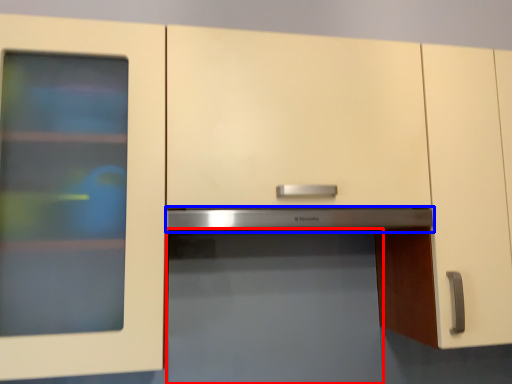
Question: Among these objects, which one is nearest to the camera, appliance (highlighted by a red box) or exhaust hood (highlighted by a blue box)?

Choices:
 (A) appliance
 (B) exhaust hood

Answer: (A)